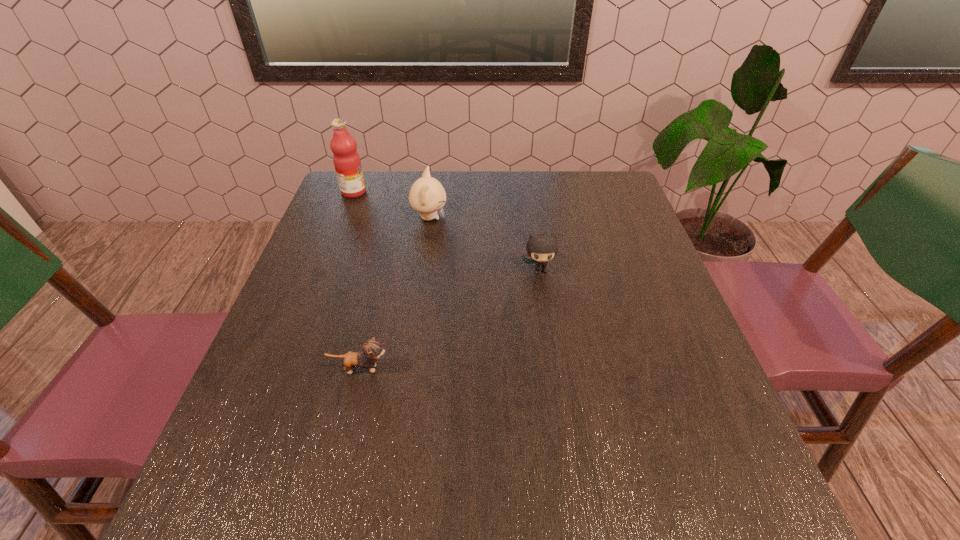
What are the coordinates of `vacant space at the right edge of the desktop` in the screenshot? It's located at (644, 295).

The image size is (960, 540). I want to click on vacant region at the far left corner of the desktop, so click(367, 171).

Where is `vacant space at the far right corner`? vacant space at the far right corner is located at coordinates (598, 185).

The height and width of the screenshot is (540, 960). Identify the location of vacant space at the near right corner of the desktop. (755, 496).

You are a GUI agent. You are given a task and a screenshot of the screen. Output one action in this format:
    pyautogui.click(x=<x>, y=<y>)
    Task: Click on the vacant space that's between the second tallest kitten and the nearest object
    This screenshot has width=960, height=540.
    Given the screenshot: What is the action you would take?
    pyautogui.click(x=450, y=319)

This screenshot has height=540, width=960. I want to click on blank region between the shortest kitten and the second shortest kitten, so click(450, 319).

Locate an element on the screen. vacant region between the farthest kitten and the shortest kitten is located at coordinates (395, 293).

This screenshot has width=960, height=540. I want to click on empty location between the fruit juice and the rightmost object, so click(x=446, y=231).

Identify the location of unoccupied area between the nearest kitten and the leftmost object. The image size is (960, 540). (357, 280).

Identify the location of empty location between the farthest kitten and the second shortest kitten. This screenshot has width=960, height=540. (485, 244).